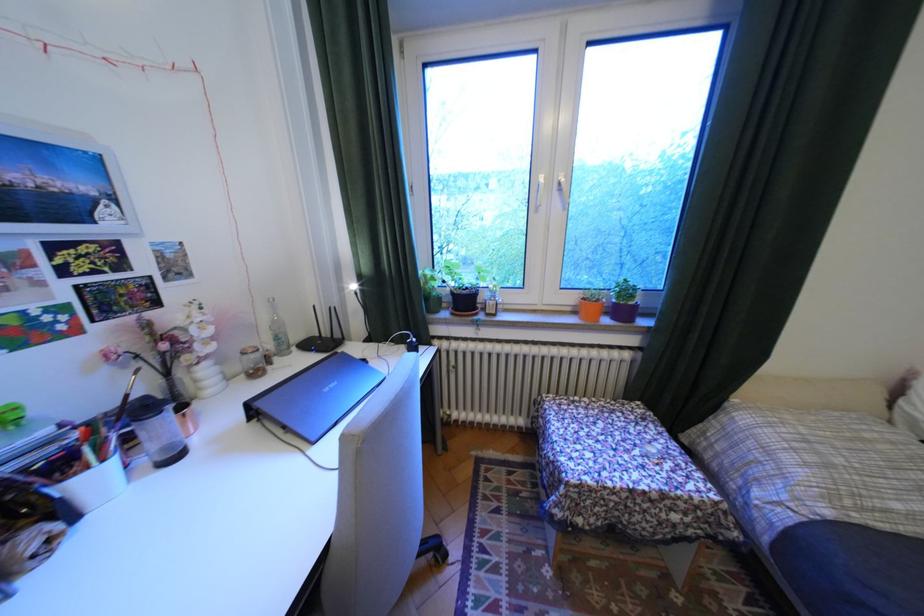
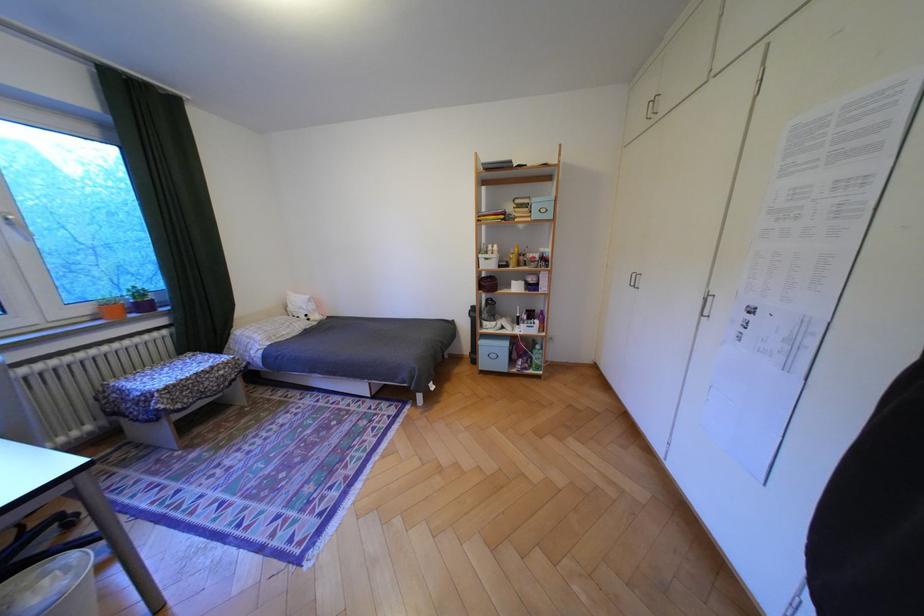
Where in the second image is the point corresponding to point (634, 312) from the first image?

(155, 307)